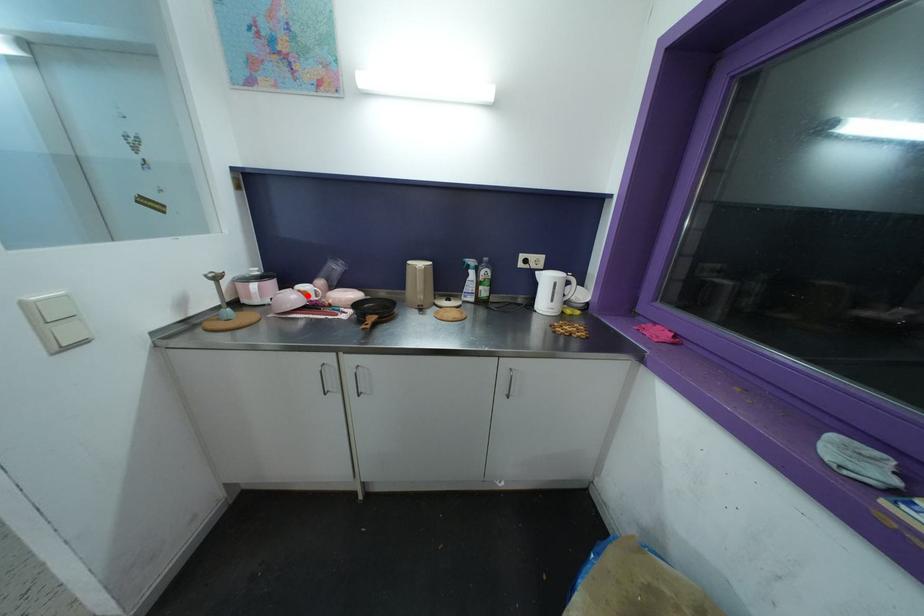
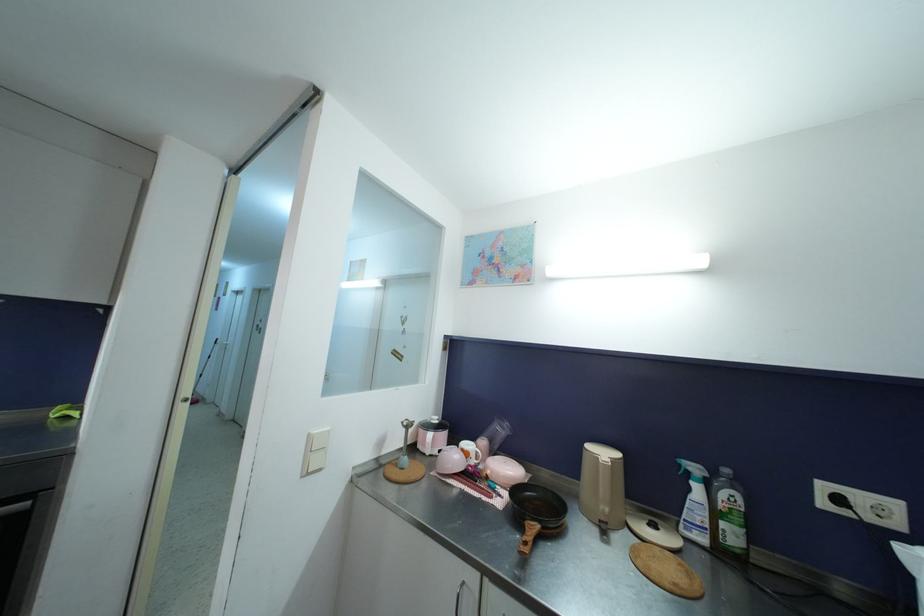
Question: A red point is marked in image1. In image2, is the corresponding 3D point closer to the camera or farther? Reply with the corresponding letter.

Choices:
 (A) The corresponding 3D point is closer.
 (B) The corresponding 3D point is farther.

Answer: (B)